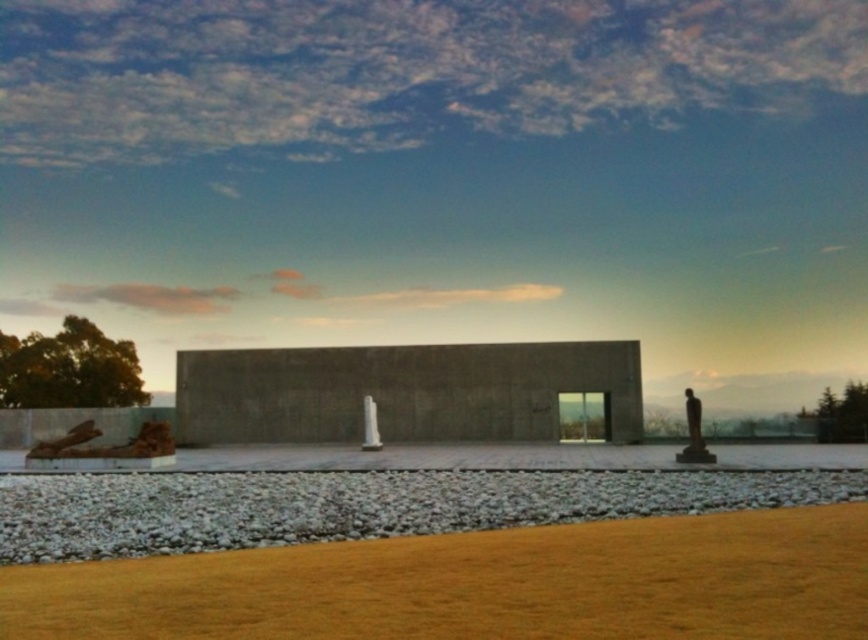
You are a landscape architect designing a pathway. The polished bronze statue at right needs to be placed so it doesn not block the view of the building from the gravel area. Based on the image, is the statue currently positioned in a way that it doesn block the view from the white gravel at lower center?

The white gravel at lower center might be wider than polished bronze statue at right, so the statue is likely positioned to the side, not blocking the view from the gravel area.

You are standing at the entrance of the modern building and want to walk to the white gravel at lower center located at point (358, 506). Which direction should you head towards?

The white gravel at lower center is located at point (358, 506), so you should head towards the lower center direction to reach it.